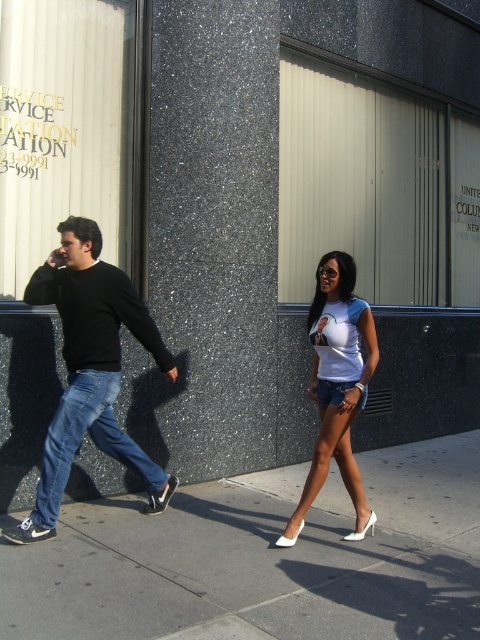
In the scene shown: Between black matte sweater at left and white matte shorts at center, which one appears on the left side from the viewer's perspective?

Positioned to the left is black matte sweater at left.

You are a GUI agent. You are given a task and a screenshot of the screen. Output one action in this format:
    pyautogui.click(x=<x>, y=<y>)
    Task: Click on the black matte sweater at left
    The height and width of the screenshot is (640, 480).
    Given the screenshot: What is the action you would take?
    pyautogui.click(x=90, y=369)

What do you see at coordinates (264, 560) in the screenshot? I see `concrete sidewalk at center` at bounding box center [264, 560].

Is point (86, 532) in front of point (339, 412)?

No, it is behind (339, 412).

You are a GUI agent. You are given a task and a screenshot of the screen. Output one action in this format:
    pyautogui.click(x=<x>, y=<y>)
    Task: Click on the concrete sidewalk at center
    
    Given the screenshot: What is the action you would take?
    pyautogui.click(x=264, y=560)

This screenshot has height=640, width=480. Describe the element at coordinates (264, 560) in the screenshot. I see `concrete sidewalk at center` at that location.

Find the location of a particular element. Image resolution: width=480 pixels, height=640 pixels. concrete sidewalk at center is located at coordinates (264, 560).

At what (x,y) coordinates should I click in order to perform the action: click on concrete sidewalk at center. Please return your answer as a coordinate pair (x, y). The image size is (480, 640). Looking at the image, I should click on (264, 560).